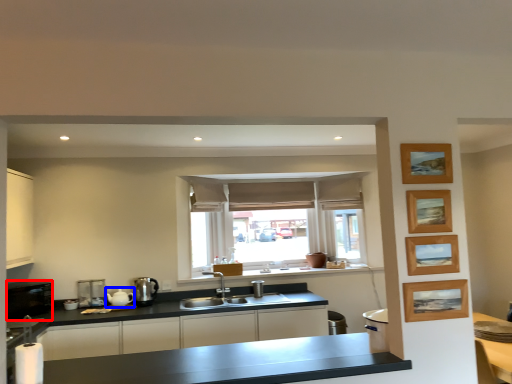
Question: Which object is closer to the camera taking this photo, appliance (highlighted by a red box) or tea pot (highlighted by a blue box)?

Choices:
 (A) appliance
 (B) tea pot

Answer: (A)